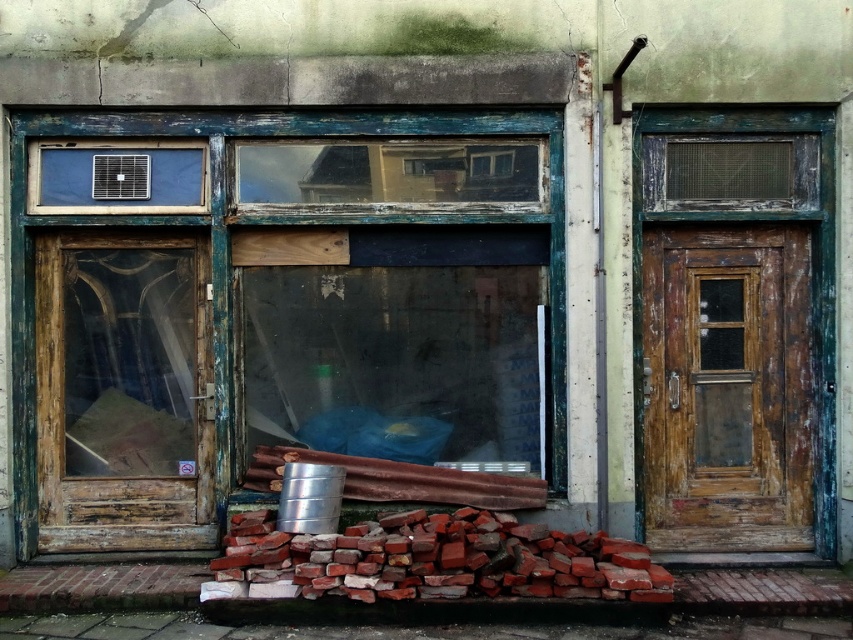
You are a delivery person trying to reach the weathered wood door at right. You are currently standing on the brick rubble at lower center. In which direction should you move to reach the door?

You should move to the right from the brick rubble at lower center to reach the weathered wood door at right since the door is located to the right of the rubble.

You are standing in front of the old building and notice two points marked on its facade. Which of the two points, point [112,541] or point [717,497], is closer to you?

Point [112,541] is closer to the viewer than point [717,497].

You are a delivery person with a package that requires a 10 feet clearance to pass through. You need to go through either the wooden door at left or the weathered wood door at right. Which door should you choose to ensure the package fits through?

The wooden door at left and weathered wood door at right are 8.32 feet apart from each other. Since the required clearance is 10 feet, neither door provides sufficient space. You may need to find an alternative route or adjust the package size.